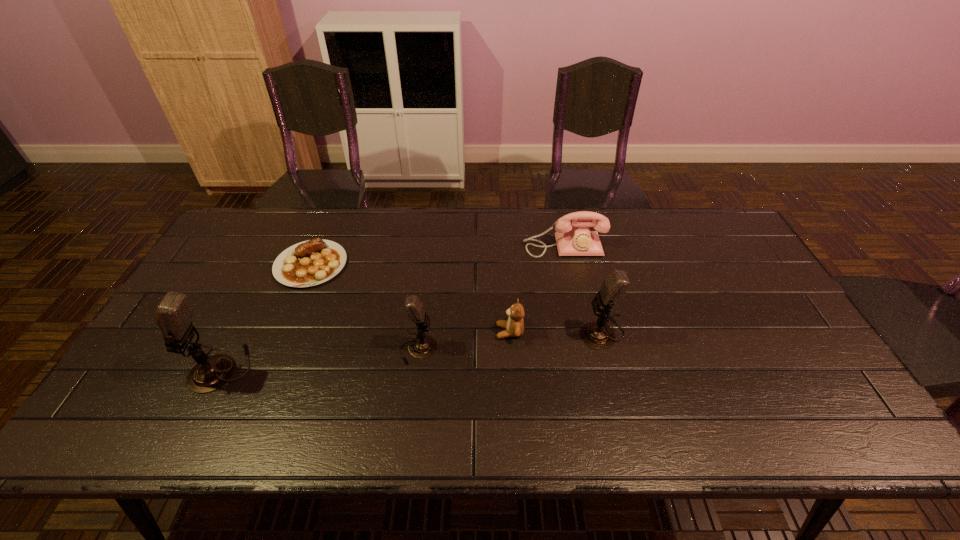
Identify the location of vacant space located 0.380m on the front-facing side of the third object from right to left. The image size is (960, 540). (356, 332).

Identify the location of vacant area located 0.170m on the dial of the telephone. The height and width of the screenshot is (540, 960). (575, 297).

Image resolution: width=960 pixels, height=540 pixels. What are the coordinates of `steak that is at the far edge` in the screenshot? It's located at (312, 262).

I want to click on telephone that is at the far edge, so click(573, 237).

Locate an element on the screen. object that is at the near edge is located at coordinates (174, 314).

Image resolution: width=960 pixels, height=540 pixels. I want to click on object located in the left edge section of the desktop, so click(174, 314).

Where is `object located in the near left corner section of the desktop`? object located in the near left corner section of the desktop is located at coordinates pos(174,314).

In the image, there is a desktop. Where is `vacant space at the far edge`? vacant space at the far edge is located at coordinates (492, 218).

The image size is (960, 540). In order to click on vacant space at the near edge of the desktop in this screenshot , I will do `click(418, 382)`.

What are the coordinates of `vacant space at the left edge of the desktop` in the screenshot? It's located at (211, 303).